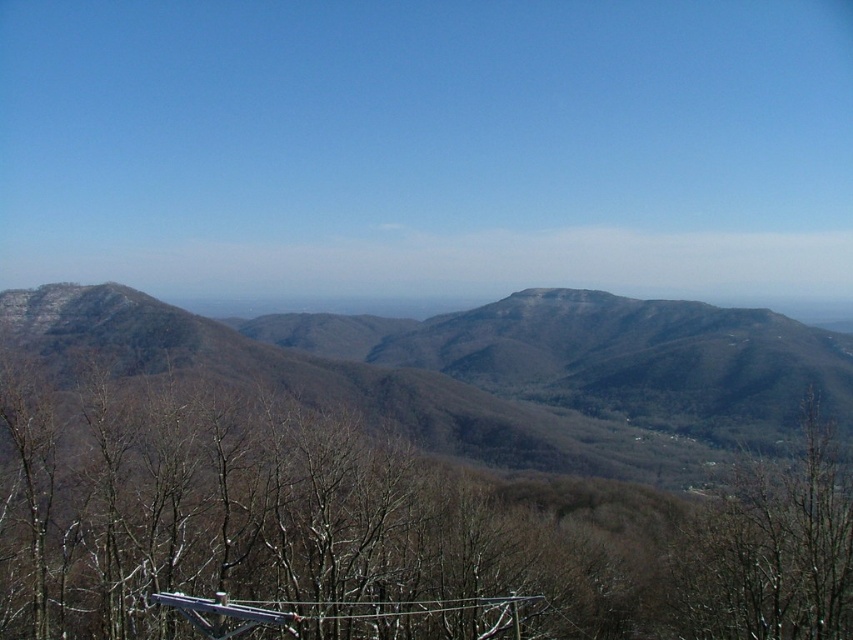
You are an observer standing at the base of the mountains. Looking at the brown textured mountain range at center and the brown leafless tree at lower right, which object appears closer to you?

The brown leafless tree at lower right is behind the brown textured mountain range at center, so the mountain range appears closer to you.

Consider the image. You are an observer standing in the mountain landscape. You see the brown textured mountain range at center and the brown leafless tree at lower right. Which object is positioned higher in the image?

The brown textured mountain range at center is positioned higher than the brown leafless tree at lower right in the image.